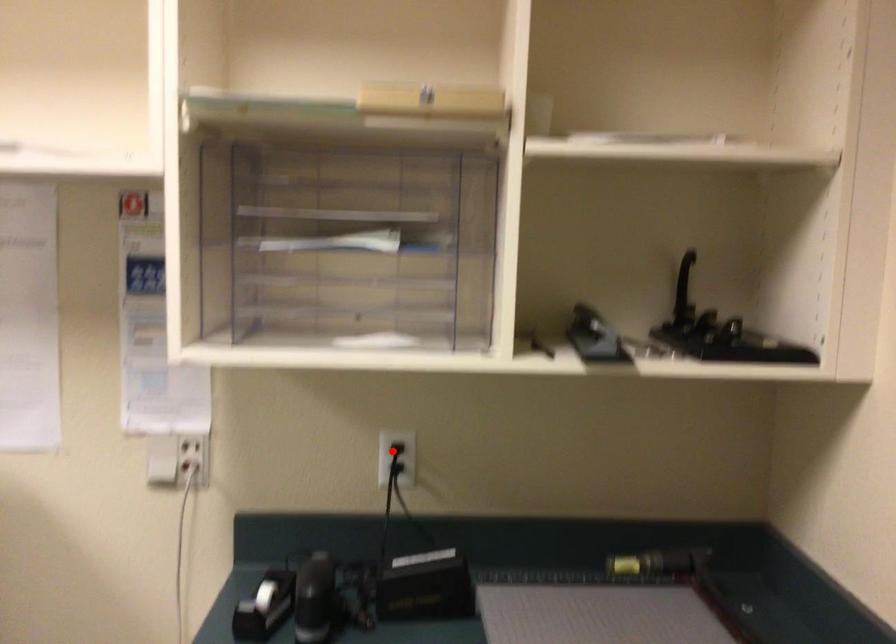
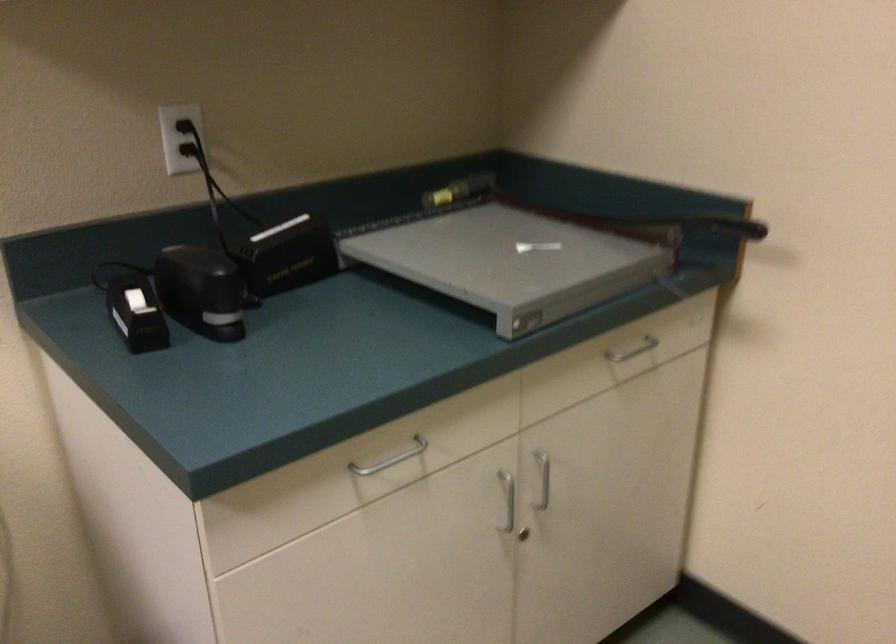
Question: I am providing you with two images of the same scene from different viewpoints. Given a red point in image1, look at the same physical point in image2. Is it:

Choices:
 (A) Closer to the viewpoint
 (B) Farther from the viewpoint

Answer: (A)